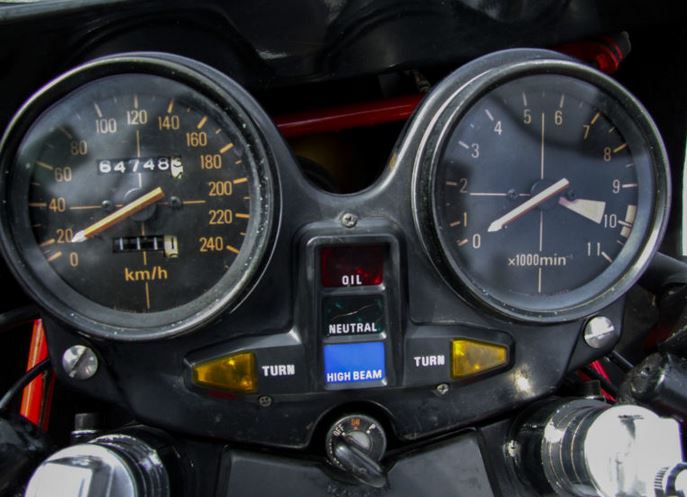
This screenshot has height=497, width=687. Identify the location of light. (365, 365).